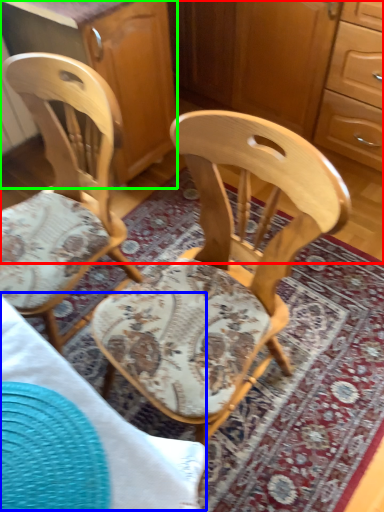
Question: Based on their relative distances, which object is nearer to dresser (highlighted by a red box)? Choose from table (highlighted by a blue box) and cabinetry (highlighted by a green box).

Choices:
 (A) table
 (B) cabinetry

Answer: (B)